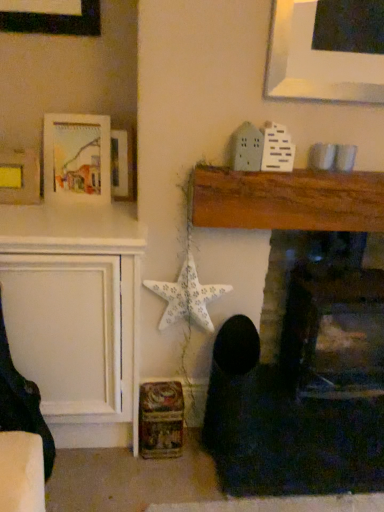
Question: Which direction should I rotate to look at wooden fireplace at center, the 1th fireplace positioned from the left, — up or down?

Choices:
 (A) down
 (B) up

Answer: (A)

Question: Considering the relative sizes of dark fabric rocking chair at left and wooden fireplace at center, the 1th fireplace positioned from the left, in the image provided, is dark fabric rocking chair at left thinner than wooden fireplace at center, the 1th fireplace positioned from the left,?

Choices:
 (A) yes
 (B) no

Answer: (B)

Question: Considering the relative sizes of dark fabric rocking chair at left and wooden fireplace at center, the 1th fireplace positioned from the left, in the image provided, is dark fabric rocking chair at left bigger than wooden fireplace at center, the 1th fireplace positioned from the left,?

Choices:
 (A) no
 (B) yes

Answer: (A)

Question: Considering the relative sizes of dark fabric rocking chair at left and wooden fireplace at center, the 1th fireplace positioned from the left, in the image provided, is dark fabric rocking chair at left smaller than wooden fireplace at center, the 1th fireplace positioned from the left,?

Choices:
 (A) yes
 (B) no

Answer: (A)

Question: Is dark fabric rocking chair at left shorter than wooden fireplace at center, the 2th fireplace in the right-to-left sequence?

Choices:
 (A) no
 (B) yes

Answer: (B)

Question: Is dark fabric rocking chair at left placed right next to wooden fireplace at center, the 1th fireplace positioned from the left?

Choices:
 (A) yes
 (B) no

Answer: (B)

Question: From a real-world perspective, does dark fabric rocking chair at left sit lower than wooden fireplace at center, the 1th fireplace positioned from the left?

Choices:
 (A) no
 (B) yes

Answer: (B)

Question: From the image's perspective, is matte yellow paper at upper left, which ranks as the third picture frame in right-to-left order, located beneath matte white picture frame at upper left, marked as the 2th picture frame in a left-to-right arrangement?

Choices:
 (A) yes
 (B) no

Answer: (A)

Question: Considering the relative sizes of matte yellow paper at upper left, which ranks as the third picture frame in right-to-left order, and matte white picture frame at upper left, marked as the 2th picture frame in a left-to-right arrangement, in the image provided, is matte yellow paper at upper left, which ranks as the third picture frame in right-to-left order, smaller than matte white picture frame at upper left, marked as the 2th picture frame in a left-to-right arrangement,?

Choices:
 (A) no
 (B) yes

Answer: (B)

Question: Is matte yellow paper at upper left, which ranks as the third picture frame in right-to-left order, positioned with its back to matte white picture frame at upper left, marked as the 2th picture frame in a left-to-right arrangement?

Choices:
 (A) yes
 (B) no

Answer: (B)

Question: Is matte yellow paper at upper left, marked as the 1th picture frame in a left-to-right arrangement, thinner than matte white picture frame at upper left, positioned as the second picture frame in right-to-left order?

Choices:
 (A) no
 (B) yes

Answer: (B)

Question: From the image's perspective, is matte yellow paper at upper left, which ranks as the third picture frame in right-to-left order, above matte white picture frame at upper left, marked as the 2th picture frame in a left-to-right arrangement?

Choices:
 (A) yes
 (B) no

Answer: (B)

Question: Is matte yellow paper at upper left, which ranks as the third picture frame in right-to-left order, positioned far away from matte white picture frame at upper left, positioned as the second picture frame in right-to-left order?

Choices:
 (A) no
 (B) yes

Answer: (A)

Question: Can you confirm if matte yellow paper at upper left, marked as the 1th picture frame in a left-to-right arrangement, is bigger than wooden fireplace at center, the 2th fireplace in the right-to-left sequence?

Choices:
 (A) yes
 (B) no

Answer: (B)